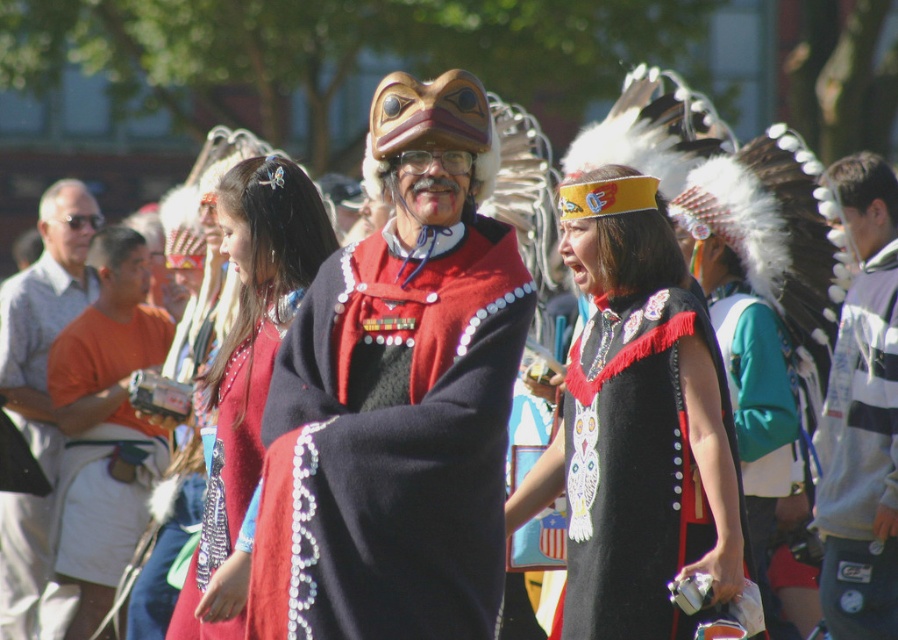
You are an artist trying to sketch this scene. You notice the velvet red cape at center and the gray striped shirt at left. Which object is shorter in height?

The velvet red cape at center has a lesser height compared to the gray striped shirt at left, so the velvet red cape at center is shorter in height.

You are an event organizer setting up a photo booth backdrop. You need to decide which item should be placed closer to the camera to ensure both the black felt cape at center and the orange cotton shirt at left are visible in the photo. Based on their sizes, which one should be positioned closer?

The black felt cape at center is smaller in size compared to the orange cotton shirt at left. To ensure both are visible, the smaller black felt cape at center should be placed closer to the camera so it appears larger in the photo, while the larger orange cotton shirt at left can be slightly farther back.

Looking at this image, you are an event organizer who needs to arrange seating for two performers. The velvet red cape at center and gray striped shirt at left are part of their costumes. Based on their sizes, which performer should sit in the smaller chair to ensure comfort?

The velvet red cape at center has a smaller size compared to the gray striped shirt at left, so the performer wearing the velvet red cape at center should sit in the smaller chair to ensure comfort.